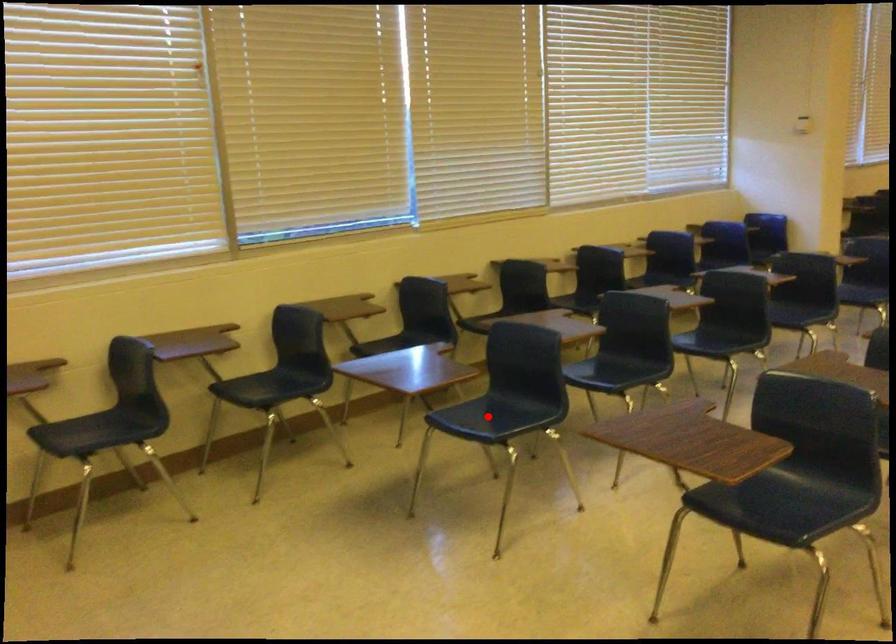
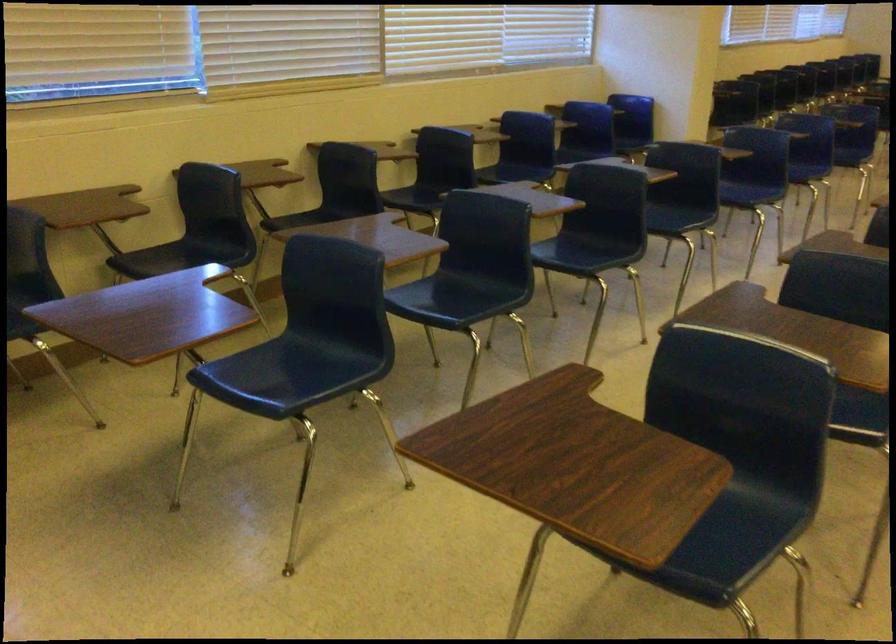
Locate, in the second image, the point that corresponds to the highlighted location in the first image.

(283, 375)